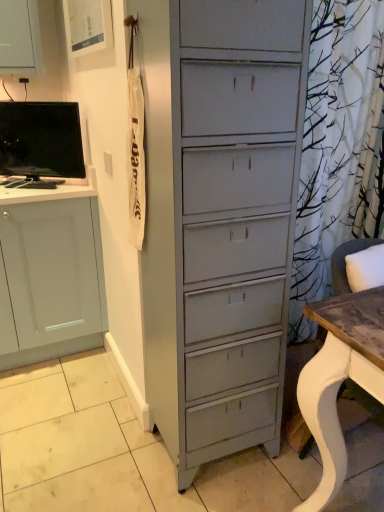
Image resolution: width=384 pixels, height=512 pixels. What do you see at coordinates (41, 139) in the screenshot? I see `matte black monitor at left` at bounding box center [41, 139].

The width and height of the screenshot is (384, 512). Find the location of `matte black monitor at left`. matte black monitor at left is located at coordinates (41, 139).

This screenshot has width=384, height=512. I want to click on white wood desk at right, so click(x=340, y=378).

The height and width of the screenshot is (512, 384). Describe the element at coordinates (340, 378) in the screenshot. I see `white wood desk at right` at that location.

Locate an element on the screen. matte black monitor at left is located at coordinates (41, 139).

Which is more to the left, white wood desk at right or matte black monitor at left?

matte black monitor at left.

Based on the photo, between white wood desk at right and matte black monitor at left, which one is positioned in front?

Positioned in front is white wood desk at right.

Which is closer to the camera, (326,361) or (27,105)?

The point (326,361) is closer to the camera.

From the image's perspective, would you say white wood desk at right is positioned over matte black monitor at left?

No, from the image's perspective, white wood desk at right is not over matte black monitor at left.

From a real-world perspective, is white wood desk at right over matte black monitor at left?

No, from a real-world perspective, white wood desk at right is not above matte black monitor at left.

Between white wood desk at right and matte black monitor at left, which one has smaller width?

matte black monitor at left is thinner.

Is white wood desk at right shorter than matte black monitor at left?

No.

Between white wood desk at right and matte black monitor at left, which one has larger size?

white wood desk at right.

Is matte black monitor at left located within white wood desk at right?

No, matte black monitor at left is located outside of white wood desk at right.

Are white wood desk at right and matte black monitor at left beside each other?

No, white wood desk at right is not in contact with matte black monitor at left.

Is white wood desk at right turned away from matte black monitor at left?

That's not correct — white wood desk at right is not looking away from matte black monitor at left.

How different are the orientations of white wood desk at right and matte black monitor at left in degrees?

The angular difference between white wood desk at right and matte black monitor at left is 34.9 degrees.

You are a GUI agent. You are given a task and a screenshot of the screen. Output one action in this format:
    pyautogui.click(x=<x>, y=<y>)
    Task: Click on the computer monitor located on the left of white wood desk at right
    
    Given the screenshot: What is the action you would take?
    pyautogui.click(x=41, y=139)

Which is more to the left, matte black monitor at left or white wood desk at right?

matte black monitor at left is more to the left.

Which is behind, matte black monitor at left or white wood desk at right?

Positioned behind is matte black monitor at left.

Is point (75, 127) positioned after point (306, 312)?

Yes, it is behind point (306, 312).

From the image's perspective, is matte black monitor at left located above or below white wood desk at right?

Based on their image positions, matte black monitor at left is located above white wood desk at right.

From a real-world perspective, which is physically below, matte black monitor at left or white wood desk at right?

In real-world perspective, white wood desk at right is lower.

Considering the relative sizes of matte black monitor at left and white wood desk at right in the image provided, is matte black monitor at left wider than white wood desk at right?

No, matte black monitor at left is not wider than white wood desk at right.

Which of these two, matte black monitor at left or white wood desk at right, stands shorter?

With less height is matte black monitor at left.

Does matte black monitor at left have a larger size compared to white wood desk at right?

Actually, matte black monitor at left might be smaller than white wood desk at right.

Would you say matte black monitor at left is inside or outside white wood desk at right?

matte black monitor at left cannot be found inside white wood desk at right.

From the picture: Is matte black monitor at left positioned far away from white wood desk at right?

Yes, matte black monitor at left and white wood desk at right are quite far apart.

Does matte black monitor at left turn towards white wood desk at right?

No.

How different are the orientations of matte black monitor at left and white wood desk at right in degrees?

matte black monitor at left and white wood desk at right are facing 34.9 degrees away from each other.

In the image, there is a matte black monitor at left. Where is `desk below it (from the image's perspective)`? The height and width of the screenshot is (512, 384). desk below it (from the image's perspective) is located at coordinates (340, 378).

At what (x,y) coordinates should I click in order to perform the action: click on desk in front of the matte black monitor at left. Please return your answer as a coordinate pair (x, y). This screenshot has height=512, width=384. Looking at the image, I should click on (340, 378).

Identify the location of computer monitor that appears above the white wood desk at right (from a real-world perspective). Image resolution: width=384 pixels, height=512 pixels. (41, 139).